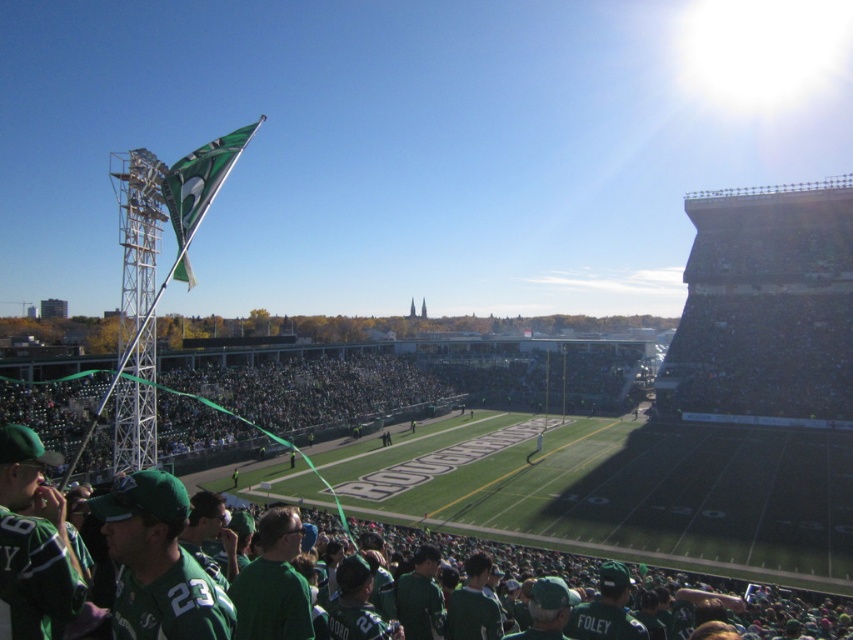
Between green matte jersey at lower left and green fabric flag at upper left, which one appears on the left side from the viewer's perspective?

green fabric flag at upper left is more to the left.

Can you confirm if green matte jersey at lower left is shorter than green fabric flag at upper left?

Indeed, green matte jersey at lower left has a lesser height compared to green fabric flag at upper left.

Locate an element on the screen. The image size is (853, 640). green matte jersey at lower left is located at coordinates (691, 550).